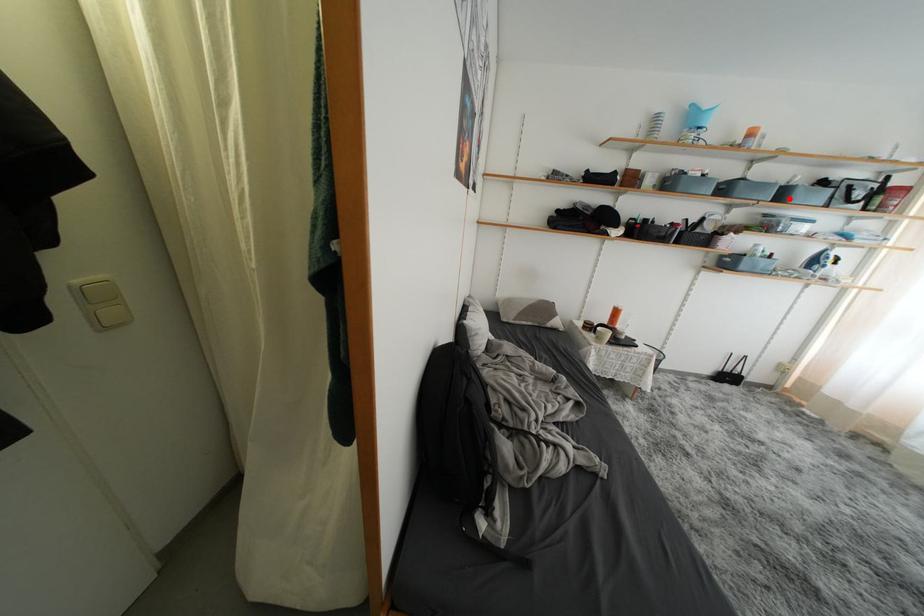
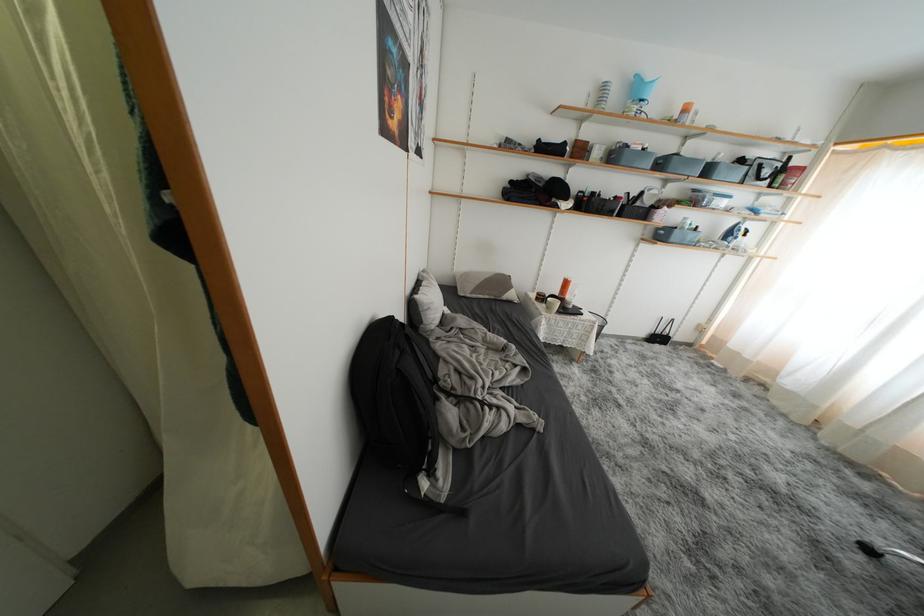
Find the pixel in the second image that matches the highlighted location in the first image.

(714, 175)